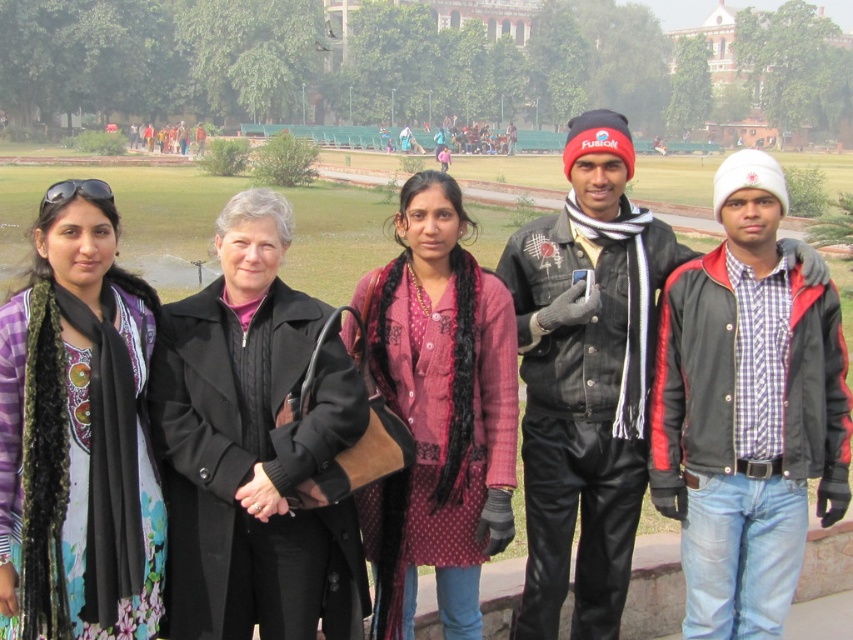
You are planning to take a photo of the printed cotton dress at left and rustic cotton kurti at center. The minimum distance required for your camera to focus clearly on both subjects simultaneously is 30 feet. Will you be able to capture both in focus without moving the camera or subjects?

The printed cotton dress at left and rustic cotton kurti at center are 29.97 feet apart, so the distance is slightly less than the required 30 feet. Therefore, the camera should be able to focus on both subjects without needing to move anything.

You are a fashion designer observing the group in the park. You notice the printed cotton dress at left and the rustic cotton kurti at center. Which of these two outfits is larger in size?

The rustic cotton kurti at center is larger than the printed cotton dress at left.